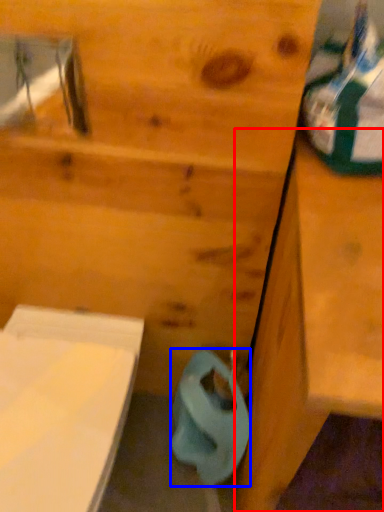
Question: Which object is closer to the camera taking this photo, vanity (highlighted by a red box) or toilet paper (highlighted by a blue box)?

Choices:
 (A) vanity
 (B) toilet paper

Answer: (A)